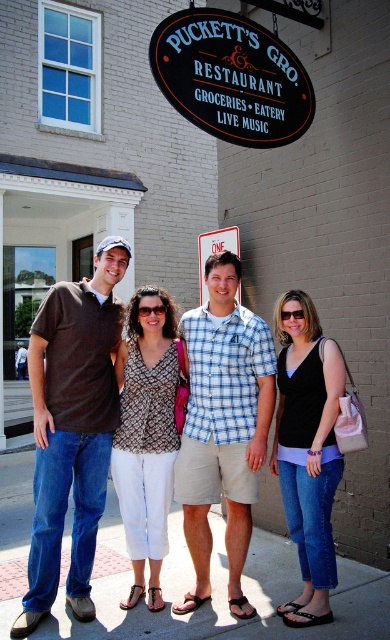
You are a photographer trying to capture a group photo of the matte brown polo shirt at left and the black denim jeans at center. Since you want to ensure both subjects are clearly visible, which subject should you focus on more to account for their sizes?

The matte brown polo shirt at left is larger in width than the black denim jeans at center, so you should focus more on the matte brown polo shirt at left to ensure it is clearly visible.

In the scene shown: Based on the scene description, can you determine the spatial relationship between the matte brown polo shirt at left and the blue plaid shirt at center? Please explain using the provided details.

The matte brown polo shirt at left is positioned to the left of the blue plaid shirt at center, meaning the blue plaid shirt at center is located to the right side of the matte brown polo shirt at left.

You are a photographer taking a picture of the matte brown polo shirt at left and the black denim jeans at center. Which object is positioned closer to the camera?

The matte brown polo shirt at left is closer to the viewer than the black denim jeans at center, so the matte brown polo shirt at left is positioned closer to the camera.